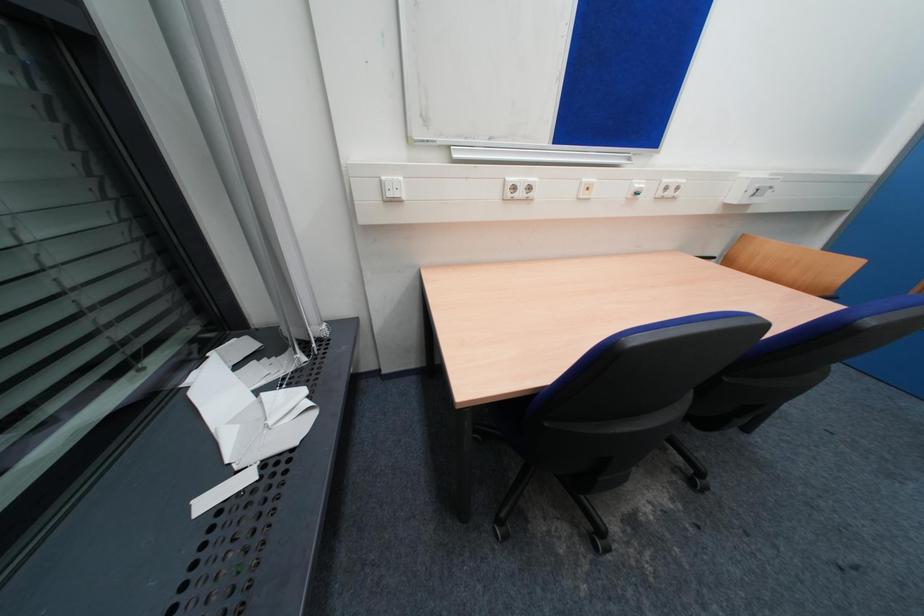
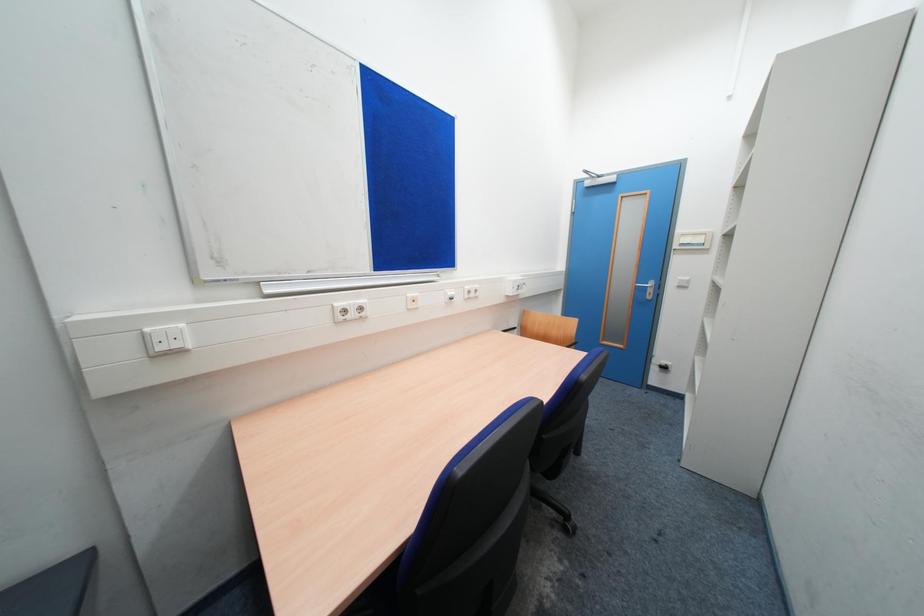
Question: Based on the continuous images, in which direction is the camera rotating? Reply with the corresponding letter.

Choices:
 (A) Left
 (B) Right
 (C) Up
 (D) Down

Answer: (B)